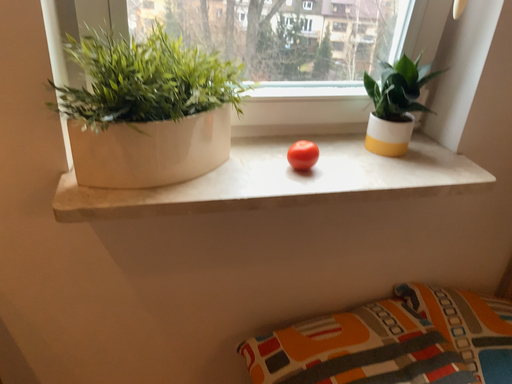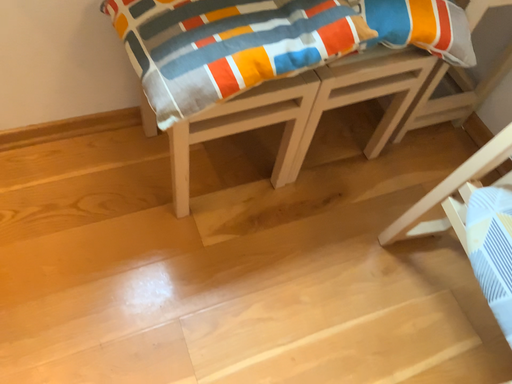
Question: Which way did the camera rotate in the video?

Choices:
 (A) rotated left
 (B) rotated right

Answer: (B)